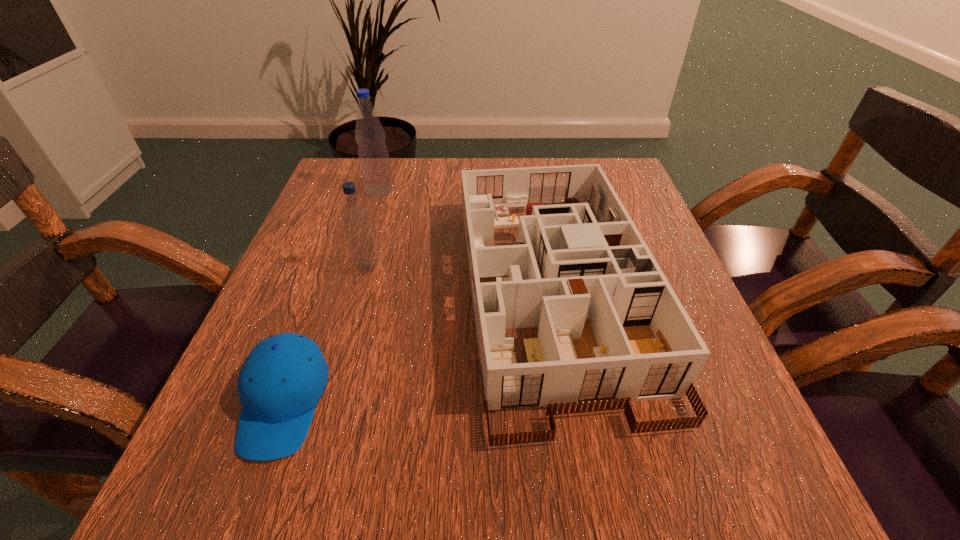
Find the location of a particular element. object that is at the near right corner is located at coordinates (612, 330).

Identify the location of vacant space at the far edge of the desktop. (444, 198).

Where is `free space at the near edge of the desktop`? This screenshot has height=540, width=960. free space at the near edge of the desktop is located at coordinates point(646,489).

Find the location of a particular element. The height and width of the screenshot is (540, 960). blank space at the left edge of the desktop is located at coordinates (303, 226).

Find the location of a particular element. free space at the right edge is located at coordinates [653, 403].

You are a GUI agent. You are given a task and a screenshot of the screen. Output one action in this format:
    pyautogui.click(x=<x>, y=<y>)
    Task: Click on the free space at the far left corner
    
    Given the screenshot: What is the action you would take?
    pyautogui.click(x=372, y=206)

Image resolution: width=960 pixels, height=540 pixels. What are the coordinates of `vacant area at the near left corner of the desktop` in the screenshot? It's located at (233, 461).

Identify the location of free spot between the shortest object and the third shortest object. (325, 335).

Where is `free spot between the cap and the dollhouse`? Image resolution: width=960 pixels, height=540 pixels. free spot between the cap and the dollhouse is located at coordinates (419, 347).

At what (x,y) coordinates should I click in order to perform the action: click on unoccupied position between the cap and the tallest object. Please return your answer as a coordinate pair (x, y). Looking at the image, I should click on (332, 296).